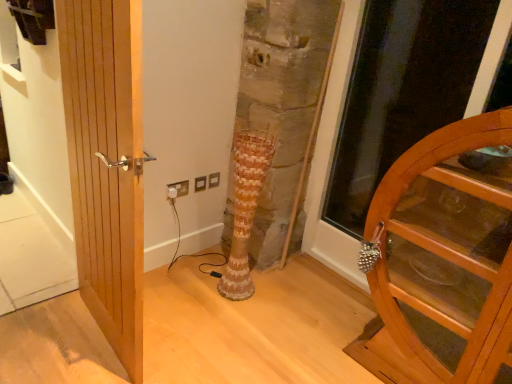
You are a GUI agent. You are given a task and a screenshot of the screen. Output one action in this format:
    pyautogui.click(x=<x>, y=<y>)
    Task: Click on the free spot to the left of brown textured vase at center
    
    Given the screenshot: What is the action you would take?
    pyautogui.click(x=197, y=289)